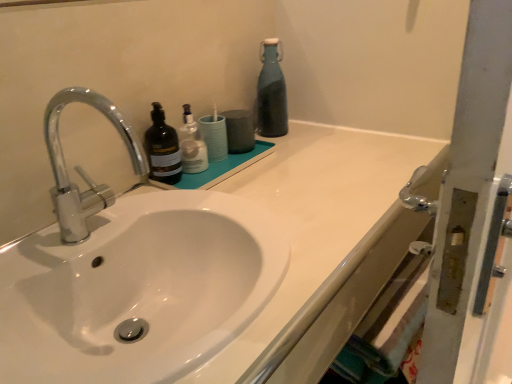
Question: From the image's perspective, is polished chrome faucet at left positioned above or below teal glass bottle at upper right, which is counted as the third bottle, starting from the left?

Choices:
 (A) above
 (B) below

Answer: (B)

Question: From their relative heights in the image, would you say polished chrome faucet at left is taller or shorter than teal glass bottle at upper right, which is counted as the third bottle, starting from the left?

Choices:
 (A) tall
 (B) short

Answer: (A)

Question: Which of these objects is positioned closest to the translucent plastic bottle at center, the second bottle viewed from the left?

Choices:
 (A) metallic silver screen door at right
 (B) matte black bottle at center, the 1th bottle when ordered from left to right
 (C) teal glass bottle at upper right, which is the 3th bottle from front to back
 (D) white glossy bottle at upper center
 (E) white glossy sink at center

Answer: (D)

Question: Which object is positioned closest to the translucent plastic bottle at center, the 2th bottle viewed from the front?

Choices:
 (A) matte black bottle at center, the 1th bottle when ordered from left to right
 (B) metallic silver screen door at right
 (C) teal glass bottle at upper right, which is the 3th bottle from front to back
 (D) white glossy bottle at upper center
 (E) white glossy sink at center

Answer: (D)